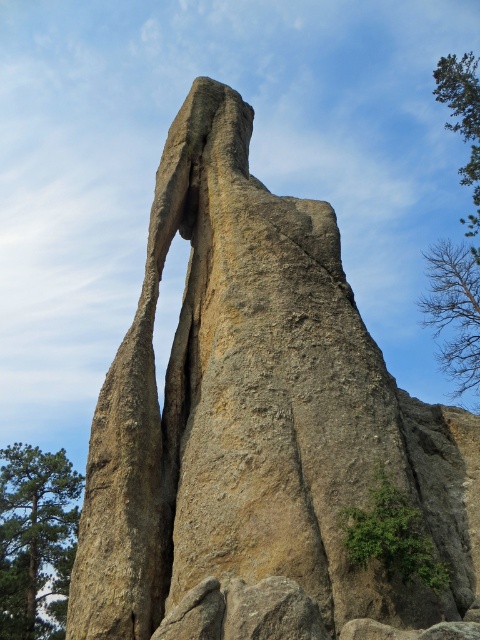
You are standing at the base of the tall rock pillar and want to take a photo that includes both the green leafy tree at left and the archway of the rock formation. Given that your camera has a maximum zoom range of 100 meters, will you need to zoom in to include both in the frame?

The green leafy tree at left is 108.82 meters away from the camera. Since the camera can only zoom up to 100 meters, you will need to zoom in beyond its maximum range to capture both the tree and the archway in the same frame.

You are standing at the base of the rock formation and want to take a photo of the archway. The camera you are using has a maximum focus range of 150 feet. Will the point at point (367,512) be in focus?

The distance of point (367,512) from camera is 153.17 feet, which exceeds the camera maximum focus range of 150 feet. So the point will not be in focus.